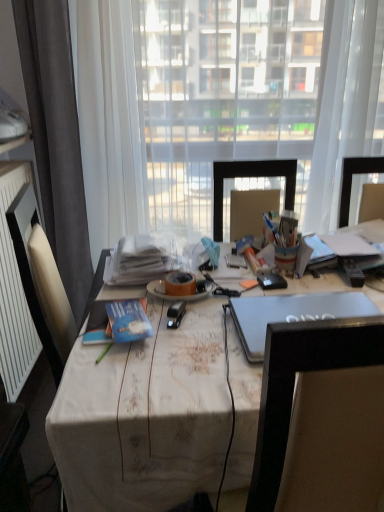
Identify the location of vacant area that is in front of orange matte plate at center. (193, 324).